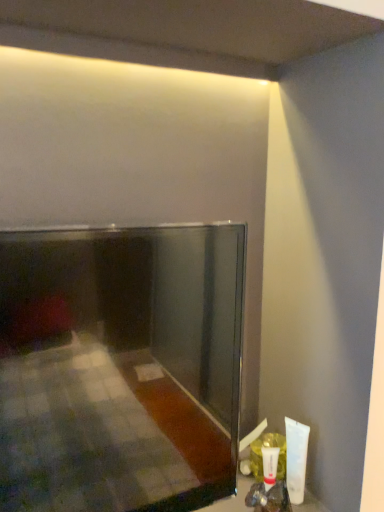
What is the approximate width of matte black mirror at center?

It is 14.61 centimeters.

This screenshot has height=512, width=384. What do you see at coordinates (120, 367) in the screenshot?
I see `matte black mirror at center` at bounding box center [120, 367].

I want to click on matte black mirror at center, so click(120, 367).

Find the location of a particular element. The height and width of the screenshot is (512, 384). matte black mirror at center is located at coordinates (120, 367).